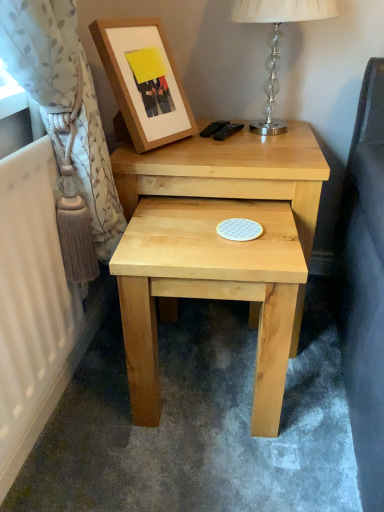
Find the location of a particular element. The height and width of the screenshot is (512, 384). vacant area in front of clear glass lamp at upper right is located at coordinates (277, 159).